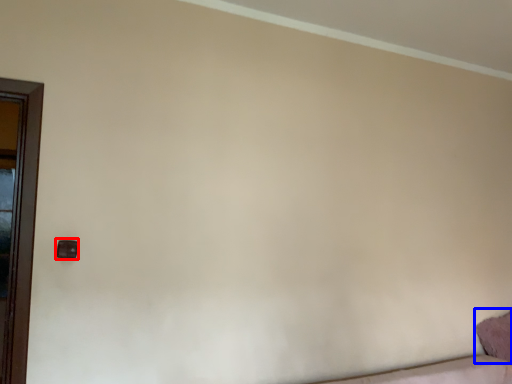
Question: Which object is closer to the camera taking this photo, door handle (highlighted by a red box) or pillow (highlighted by a blue box)?

Choices:
 (A) door handle
 (B) pillow

Answer: (A)